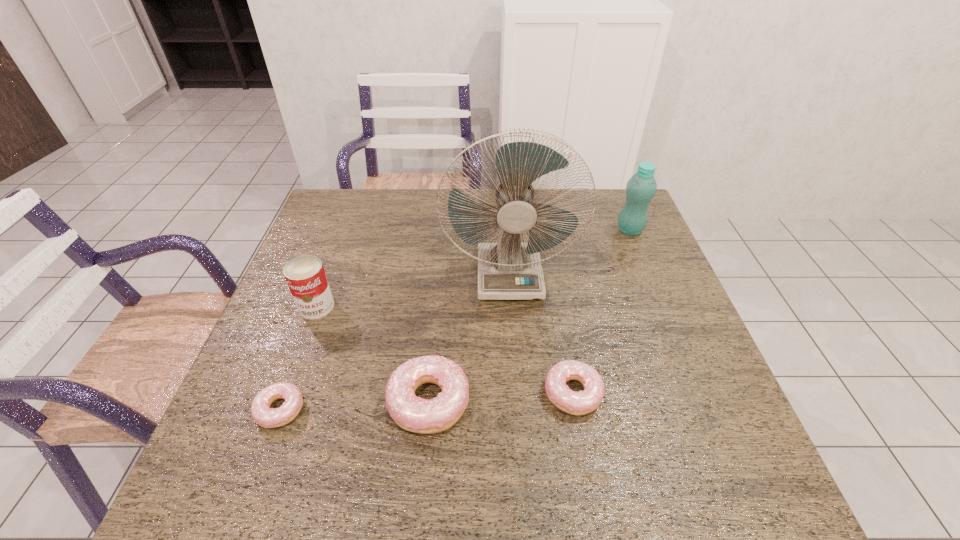
Identify the location of the shortest object. (266, 417).

This screenshot has width=960, height=540. In order to click on the leftmost doughnut in this screenshot , I will do `click(266, 417)`.

What are the coordinates of `the second doughnut from left to right` in the screenshot? It's located at (412, 413).

The image size is (960, 540). In order to click on the fourth tallest object in this screenshot , I will do `click(412, 413)`.

Locate an element on the screen. This screenshot has width=960, height=540. the fifth tallest object is located at coordinates (582, 402).

Find the location of a particular element. The image size is (960, 540). the rightmost doughnut is located at coordinates (582, 402).

This screenshot has width=960, height=540. Find the location of `the rightmost object`. the rightmost object is located at coordinates (641, 188).

At what (x,y) coordinates should I click in order to perform the action: click on the second tallest object. Please return your answer as a coordinate pair (x, y). Image resolution: width=960 pixels, height=540 pixels. Looking at the image, I should click on (641, 188).

Locate an element on the screen. Image resolution: width=960 pixels, height=540 pixels. the fourth shortest object is located at coordinates (305, 276).

Find the location of a particular element. fan is located at coordinates (507, 270).